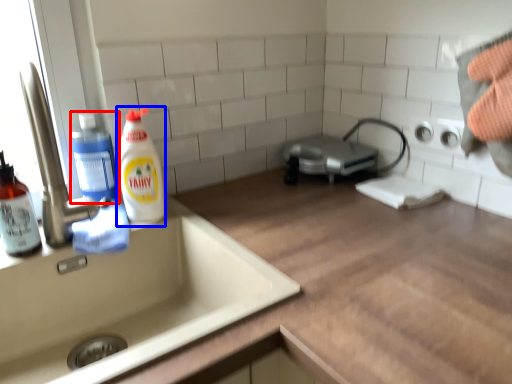
Question: Which of the following is the farthest to the observer, cleaning product (highlighted by a red box) or cleaning product (highlighted by a blue box)?

Choices:
 (A) cleaning product
 (B) cleaning product

Answer: (A)